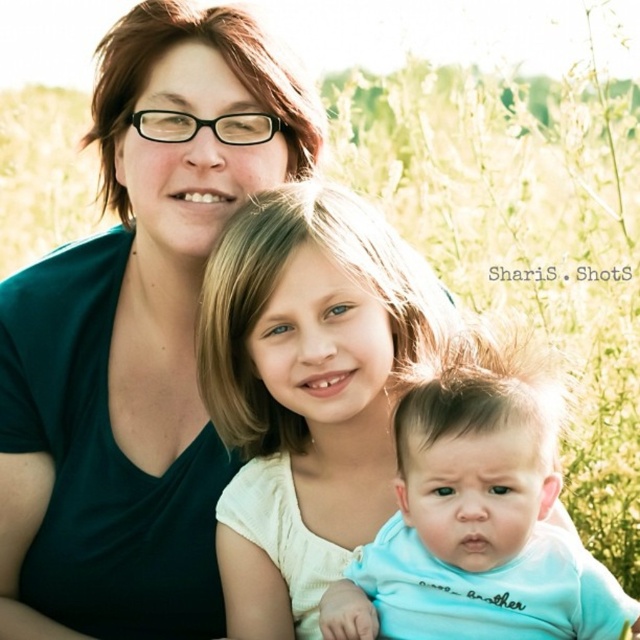
You are a photographer trying to capture a closeup of the smooth cream shirt at center and the light blue fabric baby at center. Which one is positioned higher in the frame?

The smooth cream shirt at center is positioned higher in the frame than the light blue fabric baby at center.

You are a photographer setting up for a family photo. You have a camera with a zoom lens that can focus on objects within a 30cm range. The smooth cream shirt at center and the light blue fabric baby at center are both in your frame. Can your camera focus on both subjects simultaneously without needing to adjust the zoom?

The smooth cream shirt at center has a larger size compared to light blue fabric baby at center. Since the camera can focus on objects within a 30cm range, and the shirt is larger, it might be easier to focus on it. However, the baby is smaller and closer to the center, so you may need to adjust the zoom to ensure both are in focus.